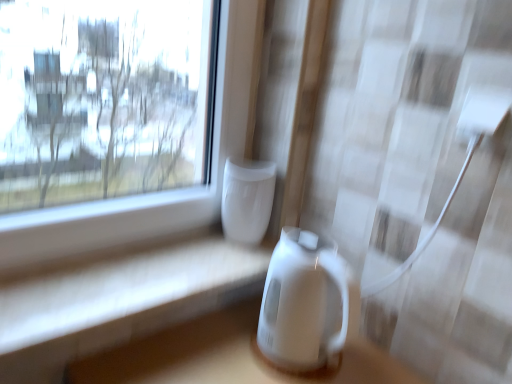
Question: Is white glossy vase at center, placed as the 1th appliance when sorted from top to bottom, next to white glossy electric kettle at center, the second appliance positioned from the top, and touching it?

Choices:
 (A) no
 (B) yes

Answer: (A)

Question: Can you confirm if white glossy vase at center, which is the second appliance from bottom to top, is positioned to the right of white glossy electric kettle at center, positioned as the 1th appliance in bottom-to-top order?

Choices:
 (A) no
 (B) yes

Answer: (A)

Question: Considering the relative sizes of white glossy vase at center, placed as the 1th appliance when sorted from top to bottom, and white glossy electric kettle at center, the second appliance positioned from the top, in the image provided, is white glossy vase at center, placed as the 1th appliance when sorted from top to bottom, bigger than white glossy electric kettle at center, the second appliance positioned from the top,?

Choices:
 (A) no
 (B) yes

Answer: (A)

Question: Is white glossy vase at center, which is the second appliance from bottom to top, oriented away from white glossy electric kettle at center, the second appliance positioned from the top?

Choices:
 (A) no
 (B) yes

Answer: (A)

Question: From the image's perspective, is white glossy vase at center, placed as the 1th appliance when sorted from top to bottom, located beneath white glossy electric kettle at center, positioned as the 1th appliance in bottom-to-top order?

Choices:
 (A) no
 (B) yes

Answer: (A)

Question: From their relative heights in the image, would you say white glossy electric kettle at center, the second appliance positioned from the top, is taller or shorter than white glossy vase at center, placed as the 1th appliance when sorted from top to bottom?

Choices:
 (A) tall
 (B) short

Answer: (A)

Question: Does point (269, 297) appear closer or farther from the camera than point (254, 198)?

Choices:
 (A) closer
 (B) farther

Answer: (A)

Question: Is white glossy electric kettle at center, positioned as the 1th appliance in bottom-to-top order, wider or thinner than white glossy vase at center, which is the second appliance from bottom to top?

Choices:
 (A) wide
 (B) thin

Answer: (A)

Question: Considering the relative positions of white glossy electric kettle at center, positioned as the 1th appliance in bottom-to-top order, and white glossy vase at center, which is the second appliance from bottom to top, in the image provided, is white glossy electric kettle at center, positioned as the 1th appliance in bottom-to-top order, to the left or to the right of white glossy vase at center, which is the second appliance from bottom to top,?

Choices:
 (A) left
 (B) right

Answer: (B)

Question: Visually, is white glossy vase at center, which is the second appliance from bottom to top, positioned to the left or to the right of white glossy electric kettle at center, positioned as the 1th appliance in bottom-to-top order?

Choices:
 (A) right
 (B) left

Answer: (B)

Question: From a real-world perspective, is white glossy vase at center, which is the second appliance from bottom to top, above or below white glossy electric kettle at center, the second appliance positioned from the top?

Choices:
 (A) below
 (B) above

Answer: (B)

Question: From the image's perspective, is white glossy vase at center, placed as the 1th appliance when sorted from top to bottom, above or below white glossy electric kettle at center, the second appliance positioned from the top?

Choices:
 (A) above
 (B) below

Answer: (A)

Question: Considering the positions of white glossy vase at center, placed as the 1th appliance when sorted from top to bottom, and white glossy electric kettle at center, the second appliance positioned from the top, in the image, is white glossy vase at center, placed as the 1th appliance when sorted from top to bottom, taller or shorter than white glossy electric kettle at center, the second appliance positioned from the top,?

Choices:
 (A) short
 (B) tall

Answer: (A)

Question: Looking at the image, does white glossy table at lower center seem bigger or smaller compared to white glossy electric kettle at center, the second appliance positioned from the top?

Choices:
 (A) small
 (B) big

Answer: (A)

Question: Is point (202, 264) positioned closer to the camera than point (264, 317)?

Choices:
 (A) farther
 (B) closer

Answer: (A)